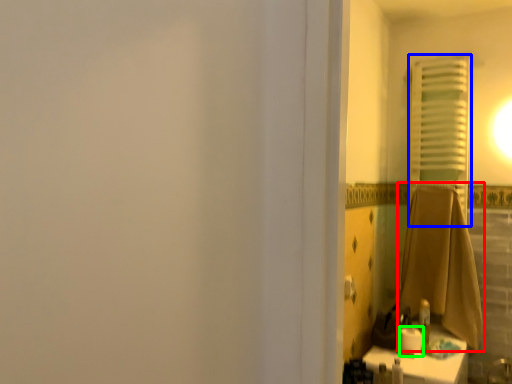
Question: Estimate the real-world distances between objects in this image. Which object is closer to bath towel (highlighted by a red box), curtain (highlighted by a blue box) or toilet paper (highlighted by a green box)?

Choices:
 (A) curtain
 (B) toilet paper

Answer: (A)